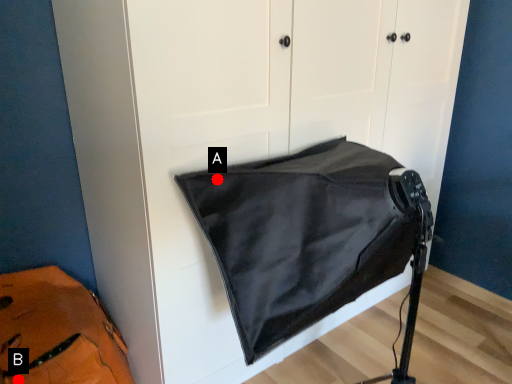
Question: Two points are circled on the image, labeled by A and B beside each circle. Which point is closer to the camera?

Choices:
 (A) A is closer
 (B) B is closer

Answer: (A)